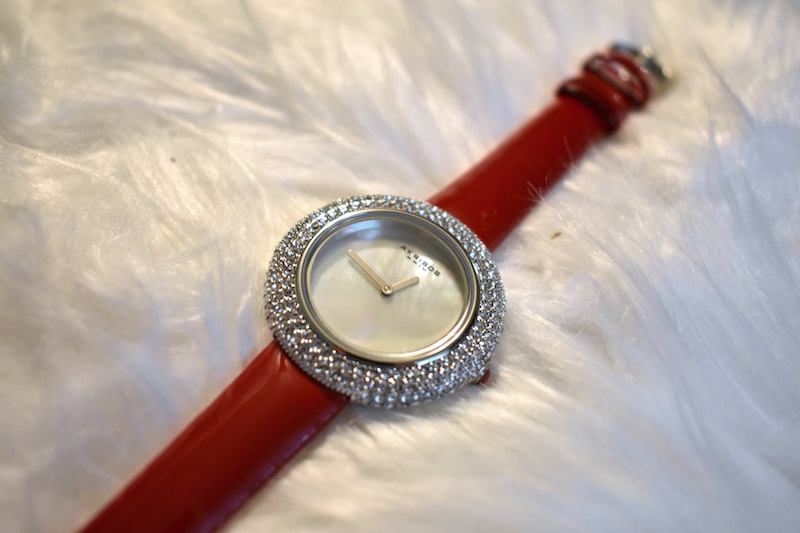
Identify the location of white fur. (130, 239).